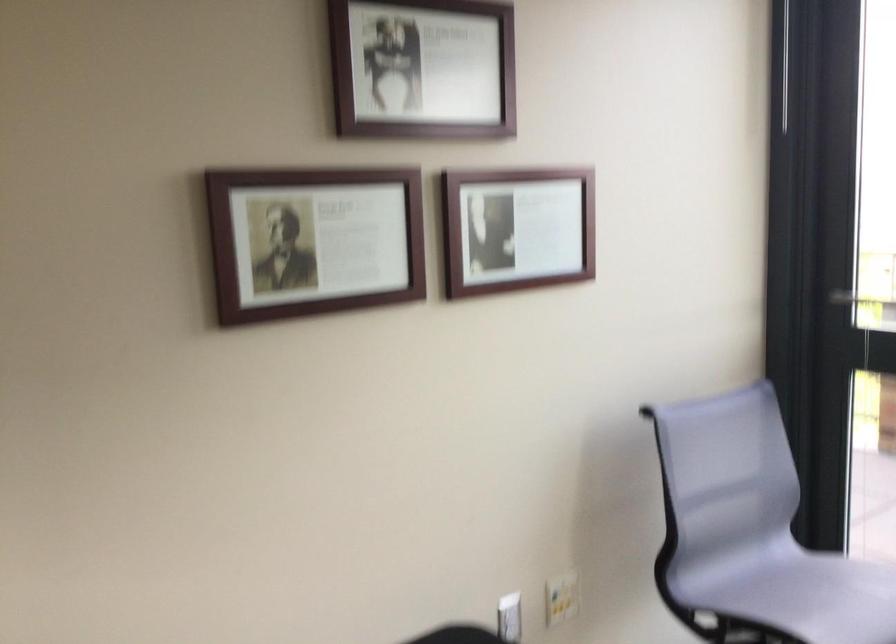
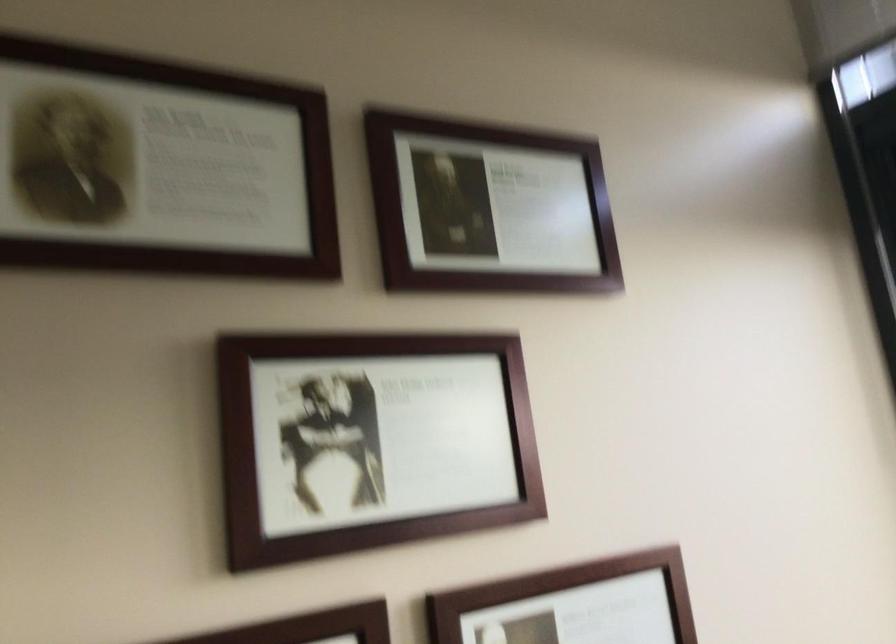
Locate, in the second image, the point that corresponds to point (417, 69) in the first image.

(373, 439)